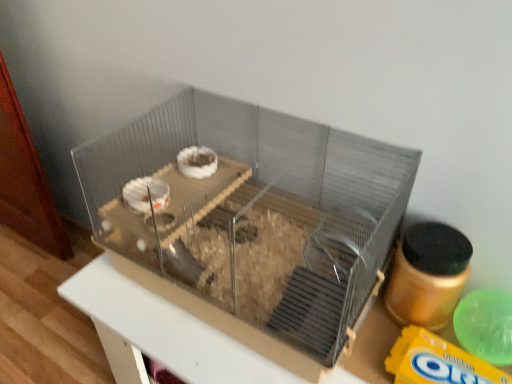
Question: In terms of size, does clear plastic cage at center appear bigger or smaller than metallic gray cage at center?

Choices:
 (A) big
 (B) small

Answer: (B)

Question: Do you think clear plastic cage at center is within metallic gray cage at center, or outside of it?

Choices:
 (A) outside
 (B) inside

Answer: (A)

Question: Considering the real-world distances, which object is farthest from the yellow matte cereal at lower right?

Choices:
 (A) clear plastic cage at center
 (B) metallic gray cage at center

Answer: (A)

Question: Estimate the real-world distances between objects in this image. Which object is farther from the metallic gray cage at center?

Choices:
 (A) clear plastic cage at center
 (B) yellow matte cereal at lower right

Answer: (B)